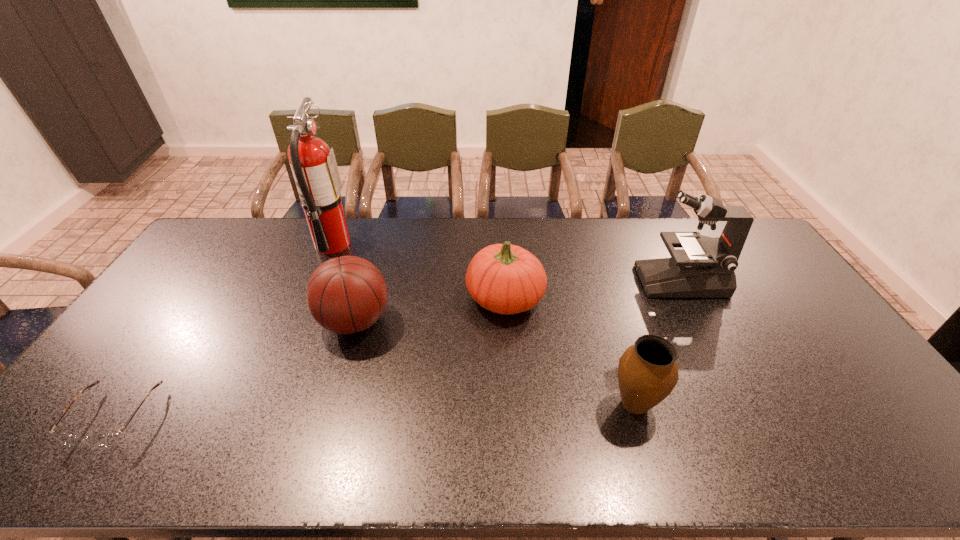
Where is `vacant region located 0.180m through the eyepieces of the microscope`? The height and width of the screenshot is (540, 960). vacant region located 0.180m through the eyepieces of the microscope is located at coordinates (586, 280).

Locate an element on the screen. Image resolution: width=960 pixels, height=540 pixels. vacant space located through the eyepieces of the microscope is located at coordinates (595, 280).

Find the location of `free space located on the left of the basketball`. free space located on the left of the basketball is located at coordinates (218, 321).

Locate an element on the screen. The image size is (960, 540). blank space located 0.150m on the front of the pumpkin is located at coordinates (509, 367).

You are a GUI agent. You are given a task and a screenshot of the screen. Output one action in this format:
    pyautogui.click(x=<x>, y=<y>)
    Task: Click on the free space located on the left of the fifth object from left to right
    
    Given the screenshot: What is the action you would take?
    pyautogui.click(x=459, y=404)

I want to click on object that is at the far edge, so click(313, 164).

Where is `object at the near edge`? The image size is (960, 540). object at the near edge is located at coordinates (108, 440).

This screenshot has height=540, width=960. Identify the location of object present at the left edge. point(108,440).

Where is `object that is at the near left corner`? Image resolution: width=960 pixels, height=540 pixels. object that is at the near left corner is located at coordinates (108, 440).

The width and height of the screenshot is (960, 540). In the image, there is a desktop. In order to click on vacant space at the far edge in this screenshot , I will do `click(301, 254)`.